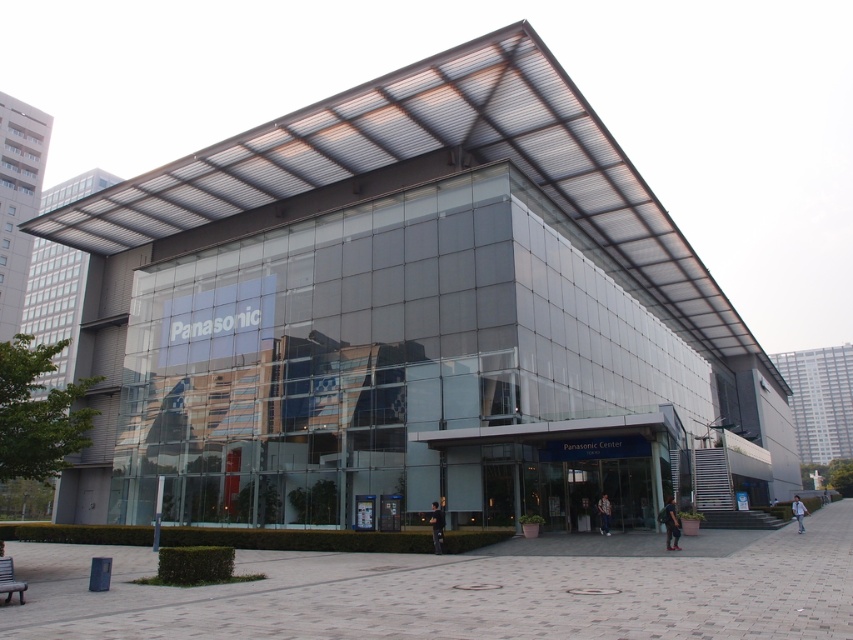
Question: Is dark gray fabric jacket at lower right to the right of black matte jacket at center from the viewer's perspective?

Choices:
 (A) no
 (B) yes

Answer: (B)

Question: Which point is farther from the camera taking this photo?

Choices:
 (A) (608, 529)
 (B) (799, 512)

Answer: (B)

Question: Is dark gray fabric jacket at lower right behind camouflage-patterned shirt at center?

Choices:
 (A) no
 (B) yes

Answer: (A)

Question: Which object is closer to the camera taking this photo?

Choices:
 (A) black matte jacket at center
 (B) camouflage-patterned shirt at center

Answer: (A)

Question: Considering the real-world distances, which object is closest to the light blue denim jacket at lower right?

Choices:
 (A) black matte jacket at center
 (B) dark gray fabric jacket at lower right

Answer: (A)

Question: Is black matte jacket at center below camouflage-patterned shirt at center?

Choices:
 (A) yes
 (B) no

Answer: (B)